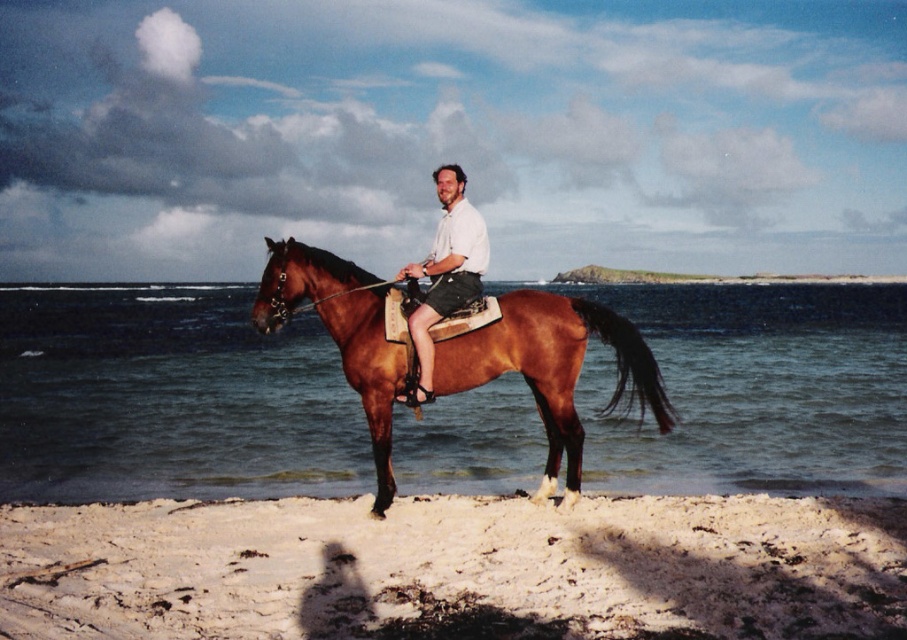
You are a photographer trying to capture the horse and the beach in a single shot. Since the shiny brown horse at center is above the white sandy beach at lower center, where should you position your camera relative to the horse to ensure both are in frame?

Position the camera below the shiny brown horse at center so that it faces upward, allowing both the horse and the white sandy beach at lower center beneath it to be captured in the same frame.

You are standing at the beach and want to take a photo of both the horse and rider. The horse and rider are located at point (x=821, y=600) and point (x=452, y=202) respectively. Since you want both subjects in focus, which point should you focus on to ensure both are clear?

You should focus on point (x=452, y=202) because it is farther from the camera than point (x=821, y=600). By focusing on the farther point, the closer point will also be within the depth of field, ensuring both are in focus.